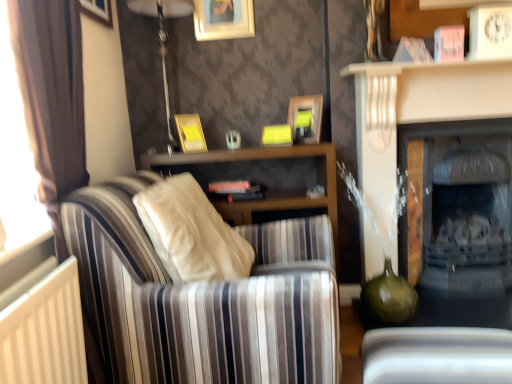
Question: Can you confirm if wooden picture frame at upper center, arranged as the third picture frame when ordered from the bottom, is wider than matte white fireplace at right, the first fireplace positioned from the front?

Choices:
 (A) yes
 (B) no

Answer: (B)

Question: Is wooden picture frame at upper center, which ranks as the fifth picture frame in left-to-right order, positioned behind matte white fireplace at right, which appears as the 2th fireplace when viewed from the back?

Choices:
 (A) no
 (B) yes

Answer: (B)

Question: Is wooden picture frame at upper center, the 1th picture frame in the right-to-left sequence, closer to the viewer compared to matte white fireplace at right, the first fireplace positioned from the front?

Choices:
 (A) no
 (B) yes

Answer: (A)

Question: From a real-world perspective, is wooden picture frame at upper center, arranged as the 3th picture frame when viewed from the top, located higher than matte white fireplace at right, the first fireplace positioned from the front?

Choices:
 (A) yes
 (B) no

Answer: (A)

Question: From the image's perspective, is wooden picture frame at upper center, the 1th picture frame in the right-to-left sequence, located beneath matte white fireplace at right, which appears as the 2th fireplace when viewed from the back?

Choices:
 (A) yes
 (B) no

Answer: (B)

Question: Considering the relative sizes of wooden picture frame at upper center, arranged as the 3th picture frame when viewed from the top, and matte white fireplace at right, the first fireplace positioned from the front, in the image provided, is wooden picture frame at upper center, arranged as the 3th picture frame when viewed from the top, taller than matte white fireplace at right, the first fireplace positioned from the front,?

Choices:
 (A) yes
 (B) no

Answer: (B)

Question: Can you confirm if striped fabric couch at left is bigger than yellow matte picture frame at upper center, which appears as the 2th picture frame when viewed from the right?

Choices:
 (A) no
 (B) yes

Answer: (B)

Question: Could you tell me if striped fabric couch at left is turned towards yellow matte picture frame at upper center, which is the fourth picture frame in left-to-right order?

Choices:
 (A) no
 (B) yes

Answer: (A)

Question: Is yellow matte picture frame at upper center, which ranks as the 4th picture frame in top-to-bottom order, at the back of striped fabric couch at left?

Choices:
 (A) yes
 (B) no

Answer: (B)

Question: Is striped fabric couch at left next to yellow matte picture frame at upper center, positioned as the 2th picture frame in bottom-to-top order?

Choices:
 (A) no
 (B) yes

Answer: (A)

Question: From a real-world perspective, is striped fabric couch at left located higher than yellow matte picture frame at upper center, which is the fourth picture frame in left-to-right order?

Choices:
 (A) yes
 (B) no

Answer: (B)

Question: Can you confirm if striped fabric couch at left is smaller than yellow matte picture frame at upper center, which is the fourth picture frame in left-to-right order?

Choices:
 (A) yes
 (B) no

Answer: (B)

Question: Are striped fabric couch at left and matte black fireplace at right, the 2th fireplace viewed from the front, making contact?

Choices:
 (A) no
 (B) yes

Answer: (A)